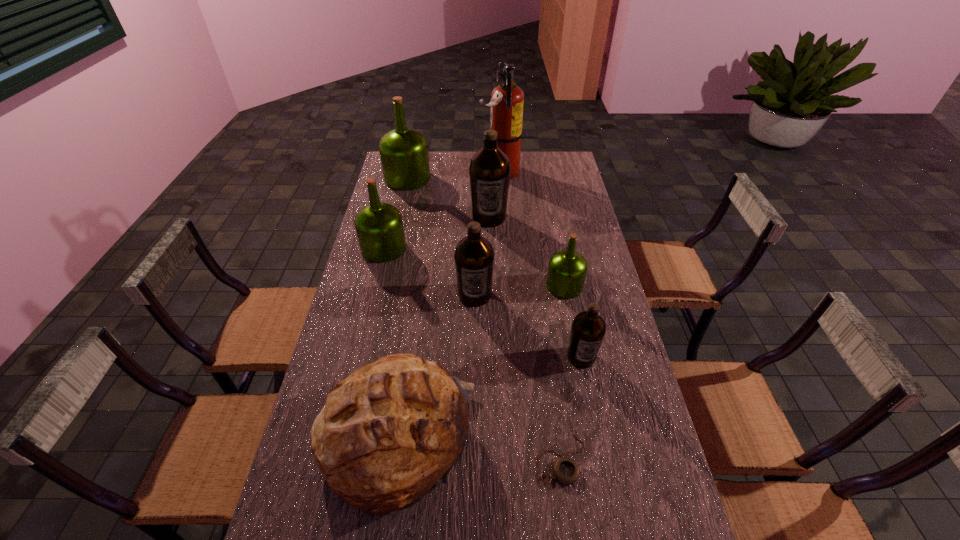
Where is `free space located 0.330m on the front of the second smallest green olive oil`? free space located 0.330m on the front of the second smallest green olive oil is located at coordinates (363, 334).

The height and width of the screenshot is (540, 960). What are the coordinates of `free space located 0.370m on the label of the second smallest brown olive oil` in the screenshot? It's located at (473, 411).

Locate an element on the screen. vacant region located on the label of the nearest olive oil is located at coordinates (590, 401).

In order to click on free space located 0.300m on the back of the rightmost green olive oil in this screenshot , I will do `click(552, 223)`.

The width and height of the screenshot is (960, 540). What are the coordinates of `vacant space positioned on the right of the bread` in the screenshot? It's located at (583, 440).

The image size is (960, 540). In order to click on vacant space situated 0.390m on the left of the shortest object in this screenshot , I will do `click(380, 459)`.

Image resolution: width=960 pixels, height=540 pixels. Identify the location of fire extinguisher present at the far edge. (507, 99).

You are a GUI agent. You are given a task and a screenshot of the screen. Output one action in this format:
    pyautogui.click(x=<x>, y=<y>)
    Task: Click on the olive oil situated at the far edge
    The width and height of the screenshot is (960, 540).
    Given the screenshot: What is the action you would take?
    pyautogui.click(x=404, y=155)

This screenshot has width=960, height=540. I want to click on bread located in the left edge section of the desktop, so click(x=389, y=433).

Locate an element on the screen. The height and width of the screenshot is (540, 960). object at the far left corner is located at coordinates (404, 155).